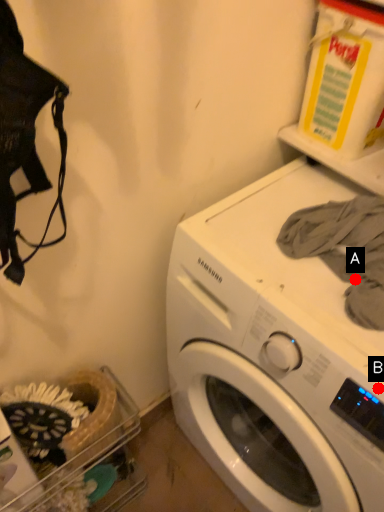
Question: Two points are circled on the image, labeled by A and B beside each circle. Which point is farther from the camera taking this photo?

Choices:
 (A) A is further
 (B) B is further

Answer: (A)